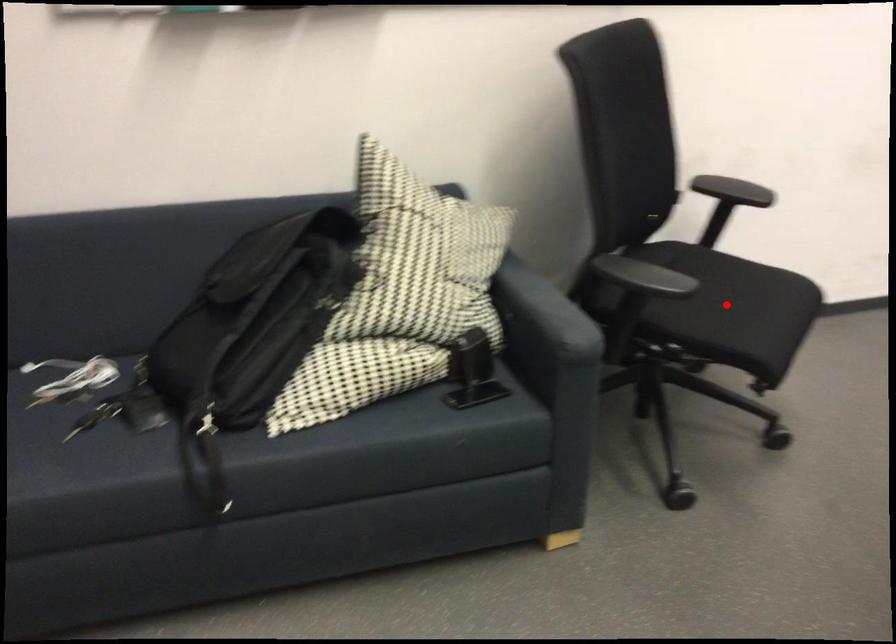
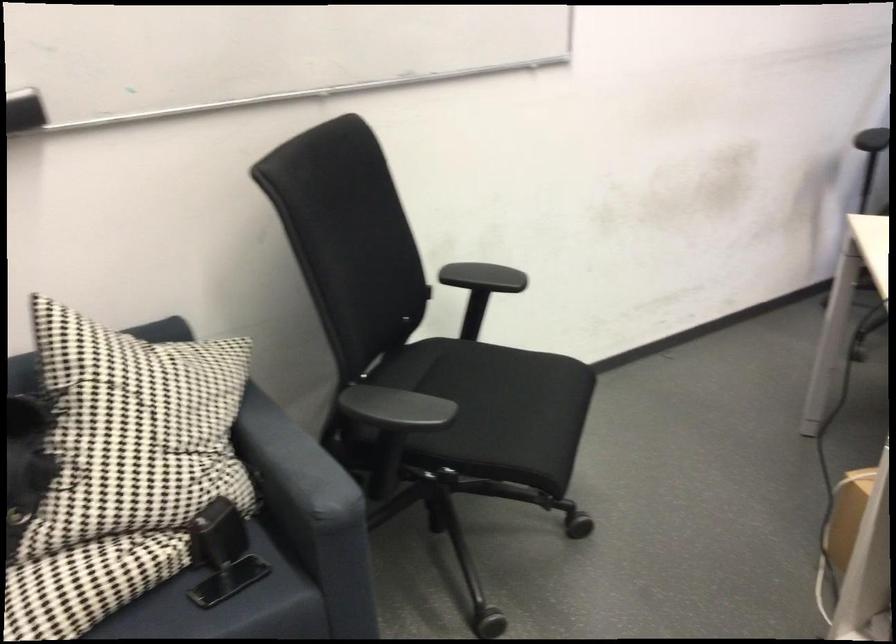
Find the pixel in the second image that matches the highlighted location in the first image.

(495, 409)